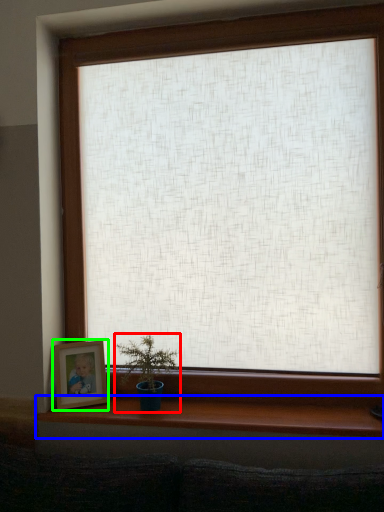
Question: Estimate the real-world distances between objects in this image. Which object is closer to houseplant (highlighted by a red box), window sill (highlighted by a blue box) or picture frame (highlighted by a green box)?

Choices:
 (A) window sill
 (B) picture frame

Answer: (B)